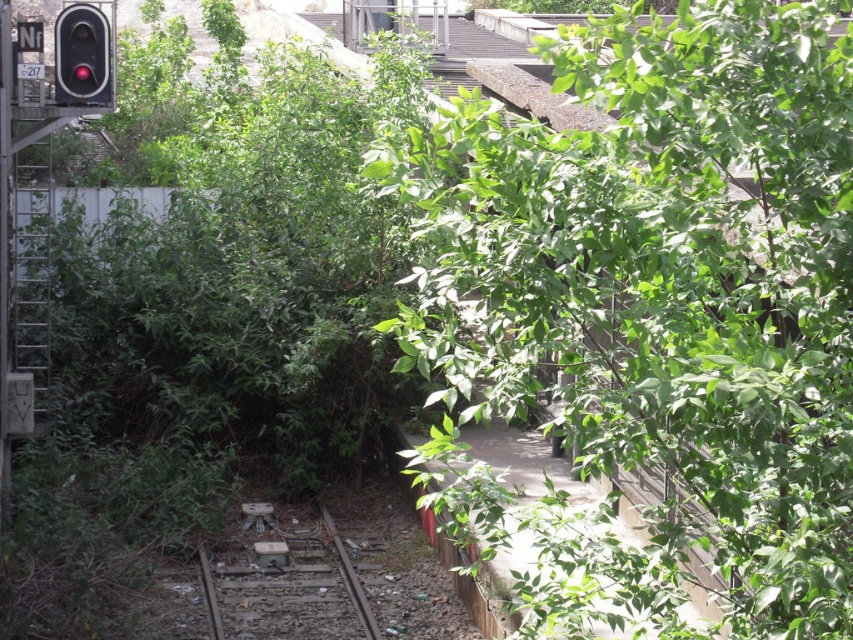
You are a maintenance worker standing at the point with coordinates 0.5, 0.5 in this image. You need to reach the dull metallic train track at center. What direction should you move to get there?

The dull metallic train track at center is located at coordinates (283,582). Since you are at (426,320), you should move to the right and slightly downward to reach it.

You are standing at the point marked by coordinates point (653,314). Looking around, you see a green leafy tree at upper right. Which direction should you face to look towards the traffic signal on the left side?

The point (653,314) marks the green leafy tree at upper right. To face the traffic signal on the left side, you should turn to face west or left direction.